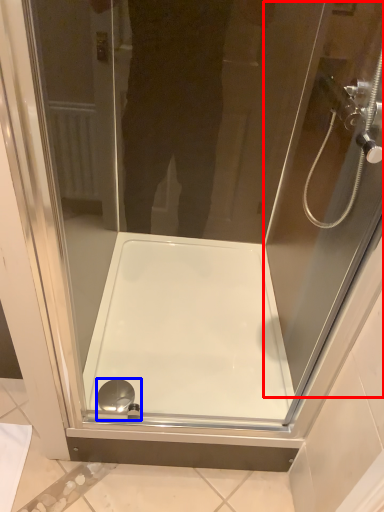
Question: Which of the following is the closest to the observer, screen door (highlighted by a red box) or shower (highlighted by a blue box)?

Choices:
 (A) screen door
 (B) shower

Answer: (A)